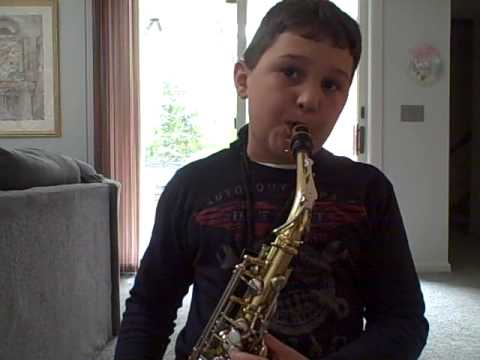
Locate an element on the screen. Image resolution: width=480 pixels, height=360 pixels. couch is located at coordinates (40, 255).